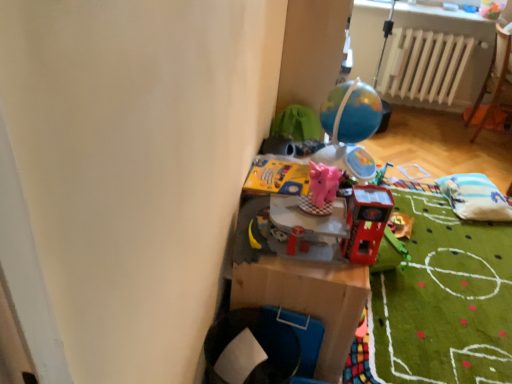
Locate an element on the screen. free spot in front of metallic red dartboard at center, the 1th toy when ordered from front to back is located at coordinates (349, 278).